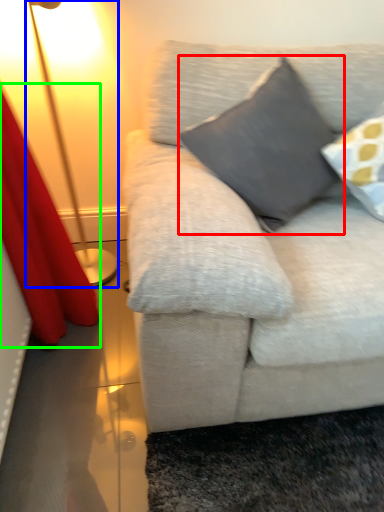
Question: Considering the real-world distances, which object is farthest from pillow (highlighted by a red box)? lamp (highlighted by a blue box) or curtain (highlighted by a green box)?

Choices:
 (A) lamp
 (B) curtain

Answer: (A)